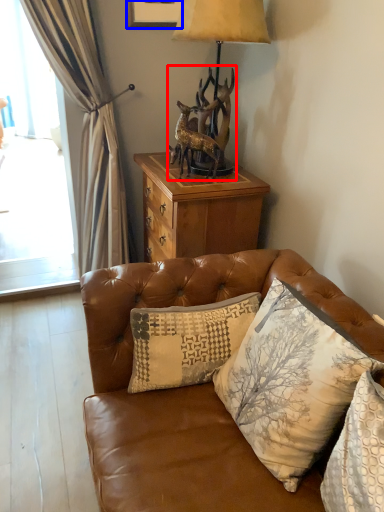
Question: Which point is closer to the camera, animal (highlighted by a red box) or picture frame (highlighted by a blue box)?

Choices:
 (A) animal
 (B) picture frame

Answer: (A)